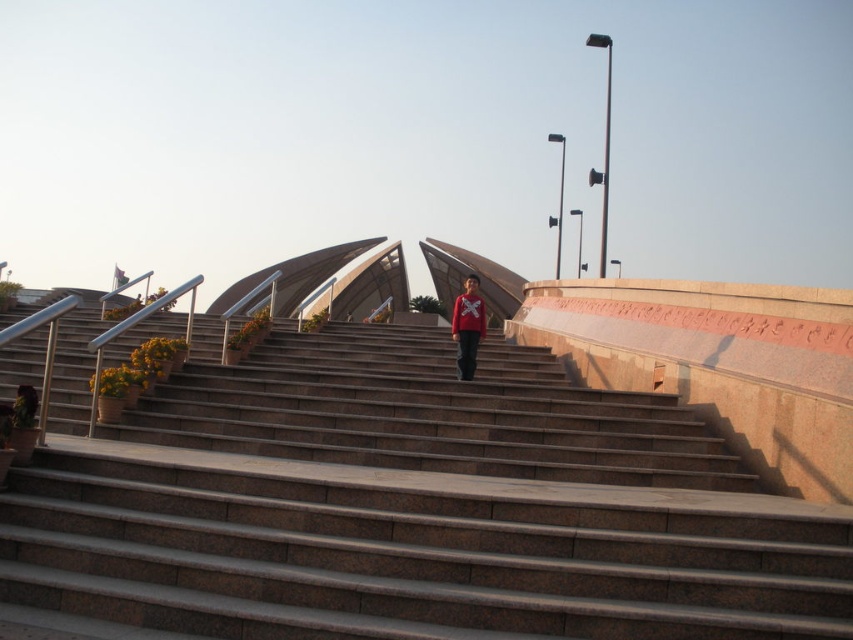
Question: Is the position of brown stone stairs at center more distant than that of matte red sweater at center?

Choices:
 (A) no
 (B) yes

Answer: (A)

Question: Where is brown stone stairs at center located in relation to matte red sweater at center in the image?

Choices:
 (A) left
 (B) right

Answer: (A)

Question: Among these objects, which one is nearest to the camera?

Choices:
 (A) matte red sweater at center
 (B) brown stone stairs at center

Answer: (B)

Question: Which of the following is the farthest from the observer?

Choices:
 (A) (289, 353)
 (B) (473, 305)

Answer: (A)

Question: Is brown stone stairs at center to the left of matte red sweater at center from the viewer's perspective?

Choices:
 (A) no
 (B) yes

Answer: (B)